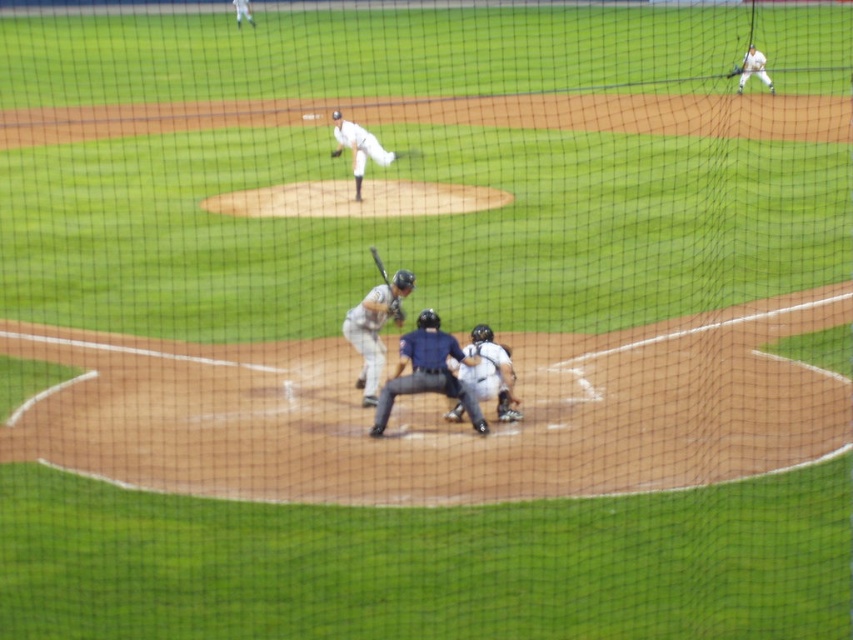
Is white uniformed player at upper right smaller than dark brown leather glove at upper center?

No, white uniformed player at upper right is not smaller than dark brown leather glove at upper center.

At what (x,y) coordinates should I click in order to perform the action: click on white uniformed player at upper right. Please return your answer as a coordinate pair (x, y). Looking at the image, I should click on 752,68.

What do you see at coordinates (752, 68) in the screenshot? I see `white uniformed player at upper right` at bounding box center [752, 68].

At what (x,y) coordinates should I click in order to perform the action: click on white uniformed player at upper right. Please return your answer as a coordinate pair (x, y). Looking at the image, I should click on (752, 68).

From the picture: Does dark blue uniform at center appear on the left side of wooden baseball bat at center?

Incorrect, dark blue uniform at center is not on the left side of wooden baseball bat at center.

Does dark blue uniform at center have a greater height compared to wooden baseball bat at center?

Yes.

Which is in front, point (448, 378) or point (387, 284)?

Point (448, 378) is in front.

You are a GUI agent. You are given a task and a screenshot of the screen. Output one action in this format:
    pyautogui.click(x=<x>, y=<y>)
    Task: Click on the dark blue uniform at center
    This screenshot has height=640, width=853.
    Given the screenshot: What is the action you would take?
    pyautogui.click(x=427, y=371)

Is gray matte bat at center behind dark brown leather glove at upper center?

No, gray matte bat at center is closer to the viewer.

Based on the photo, who is higher up, gray matte bat at center or dark brown leather glove at upper center?

Positioned higher is dark brown leather glove at upper center.

This screenshot has width=853, height=640. I want to click on gray matte bat at center, so click(x=374, y=330).

Find the location of `gray matte bat at center`. gray matte bat at center is located at coordinates (374, 330).